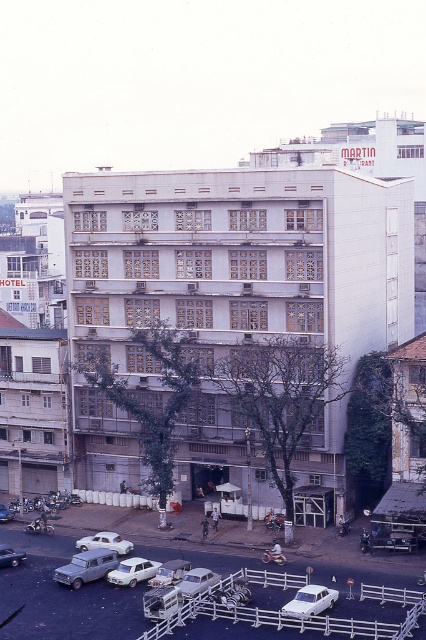
Does white matte parking lot at lower center appear over white matte sedan at lower left?

No, white matte parking lot at lower center is not above white matte sedan at lower left.

The height and width of the screenshot is (640, 426). Describe the element at coordinates (62, 595) in the screenshot. I see `white matte parking lot at lower center` at that location.

Identify the location of white matte parking lot at lower center. The height and width of the screenshot is (640, 426). (62, 595).

Is white matte sedan at center to the left of silver metallic sedan at center from the viewer's perspective?

In fact, white matte sedan at center is to the right of silver metallic sedan at center.

Where is `white matte sedan at center`? The image size is (426, 640). white matte sedan at center is located at coordinates (310, 602).

Is white matte parking lot at lower center below white matte car at center?

Yes.

Between white matte parking lot at lower center and white matte car at center, which one has more height?

white matte parking lot at lower center is taller.

Identify the location of white matte parking lot at lower center. This screenshot has height=640, width=426. (62, 595).